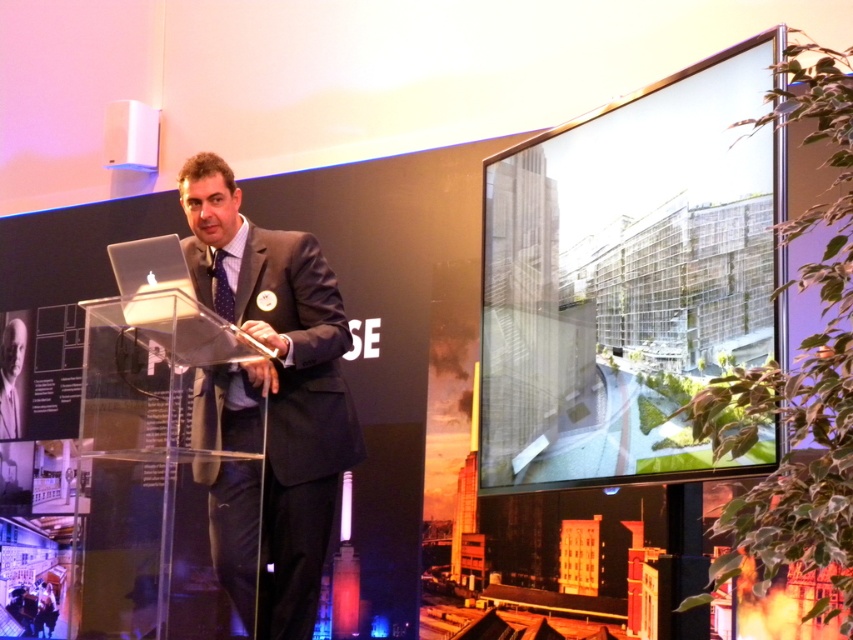
Does dark gray suit at center come behind blue dotted fabric tie at center?

→ That is False.

Can you confirm if dark gray suit at center is smaller than blue dotted fabric tie at center?

Actually, dark gray suit at center might be larger than blue dotted fabric tie at center.

Find the location of a particular element. dark gray suit at center is located at coordinates (270, 404).

This screenshot has height=640, width=853. In order to click on dark gray suit at center in this screenshot , I will do `click(270, 404)`.

Does point (695, 387) come closer to viewer compared to point (194, 268)?

Yes.

Who is shorter, transparent glass screen at upper right or dark gray suit at center?

transparent glass screen at upper right

Identify the location of transparent glass screen at upper right. (625, 276).

Between transparent glass screen at upper right and blue dotted fabric tie at center, which one appears on the left side from the viewer's perspective?

From the viewer's perspective, blue dotted fabric tie at center appears more on the left side.

Is point (685, 99) positioned in front of point (218, 275)?

Yes, it is in front of point (218, 275).

The image size is (853, 640). I want to click on transparent glass screen at upper right, so click(625, 276).